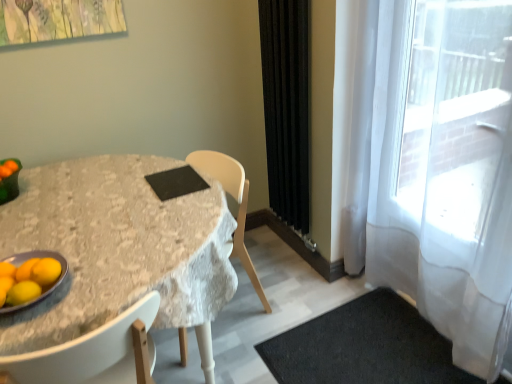
Question: Is orange matte tangerine at lower left a part of linen-covered table at center?

Choices:
 (A) no
 (B) yes

Answer: (A)

Question: Does linen-covered table at center have a lesser width compared to orange matte tangerine at lower left?

Choices:
 (A) yes
 (B) no

Answer: (B)

Question: Is linen-covered table at center oriented away from orange matte tangerine at lower left?

Choices:
 (A) yes
 (B) no

Answer: (B)

Question: Does linen-covered table at center lie in front of orange matte tangerine at lower left?

Choices:
 (A) yes
 (B) no

Answer: (A)

Question: Is linen-covered table at center with orange matte tangerine at lower left?

Choices:
 (A) yes
 (B) no

Answer: (B)

Question: From a real-world perspective, is yellow matte lemon at lower left positioned above or below black rubber doormat at lower right?

Choices:
 (A) below
 (B) above

Answer: (B)

Question: Considering the positions of yellow matte lemon at lower left and black rubber doormat at lower right in the image, is yellow matte lemon at lower left bigger or smaller than black rubber doormat at lower right?

Choices:
 (A) small
 (B) big

Answer: (A)

Question: From the image's perspective, is yellow matte lemon at lower left above or below black rubber doormat at lower right?

Choices:
 (A) above
 (B) below

Answer: (A)

Question: Considering the positions of yellow matte lemon at lower left and black rubber doormat at lower right in the image, is yellow matte lemon at lower left wider or thinner than black rubber doormat at lower right?

Choices:
 (A) wide
 (B) thin

Answer: (B)

Question: Is metallic gray platter at lower left inside or outside of yellow matte/orange at lower left?

Choices:
 (A) outside
 (B) inside

Answer: (A)

Question: From a real-world perspective, is metallic gray platter at lower left physically located above or below yellow matte/orange at lower left?

Choices:
 (A) below
 (B) above

Answer: (A)

Question: Does point (45, 291) appear closer or farther from the camera than point (53, 278)?

Choices:
 (A) farther
 (B) closer

Answer: (B)

Question: Considering the positions of metallic gray platter at lower left and yellow matte/orange at lower left in the image, is metallic gray platter at lower left bigger or smaller than yellow matte/orange at lower left?

Choices:
 (A) small
 (B) big

Answer: (B)

Question: Is point (30, 269) closer or farther from the camera than point (9, 296)?

Choices:
 (A) farther
 (B) closer

Answer: (A)

Question: Is orange matte tangerine at lower left spatially inside yellow matte lemon at lower left, or outside of it?

Choices:
 (A) outside
 (B) inside

Answer: (A)